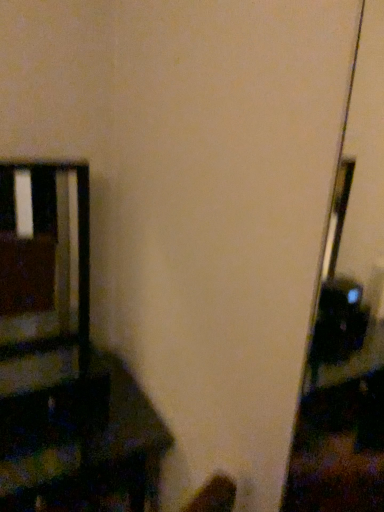
The height and width of the screenshot is (512, 384). Identify the location of wooden chair at left. (77, 437).

The height and width of the screenshot is (512, 384). Describe the element at coordinates (77, 437) in the screenshot. I see `wooden chair at left` at that location.

The width and height of the screenshot is (384, 512). Identify the location of wooden chair at left. (77, 437).